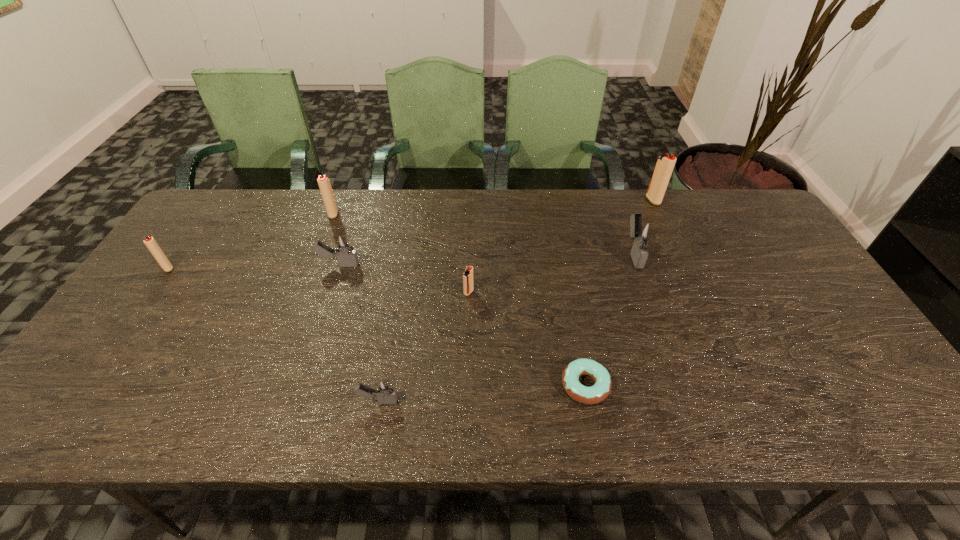
This screenshot has width=960, height=540. I want to click on the tallest igniter, so click(x=665, y=163).

Find the location of a particular element. the farthest object is located at coordinates (665, 163).

Find the location of `the third red igniter from right to left`. the third red igniter from right to left is located at coordinates (324, 183).

Locate an element on the screen. The width and height of the screenshot is (960, 540). the seventh nearest object is located at coordinates (324, 183).

Locate an element on the screen. Image resolution: width=960 pixels, height=540 pixels. the sixth igniter from left to right is located at coordinates click(642, 232).

The width and height of the screenshot is (960, 540). Identify the location of the seventh object from left to right. (642, 232).

You are a GUI agent. You are given a task and a screenshot of the screen. Output one action in this format:
    pyautogui.click(x=<x>, y=<y>)
    Task: Click on the second smallest gray igniter
    
    Given the screenshot: What is the action you would take?
    pyautogui.click(x=346, y=255)

You are a GUI agent. You are given a task and a screenshot of the screen. Output one action in this format:
    pyautogui.click(x=<x>, y=<y>)
    Task: Click on the leftmost object
    
    Given the screenshot: What is the action you would take?
    pyautogui.click(x=150, y=242)

Where is `the leftmost igniter`? The image size is (960, 540). the leftmost igniter is located at coordinates (150, 242).

Image resolution: width=960 pixels, height=540 pixels. In order to click on the sixth farthest igniter in this screenshot , I will do `click(468, 287)`.